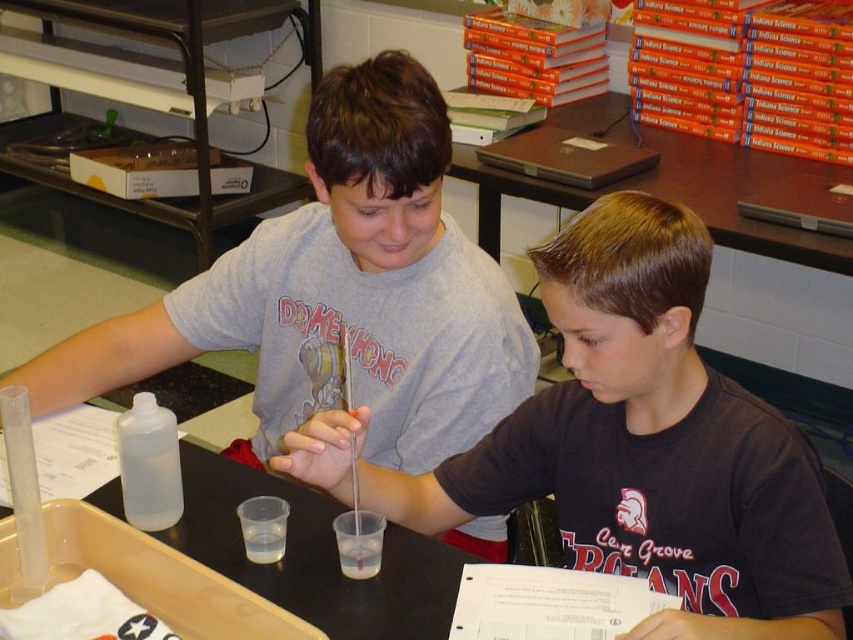
Between brown wooden table at upper center and transparent plastic bottle at center-left, which one has more height?

With more height is brown wooden table at upper center.

Which of these two, brown wooden table at upper center or transparent plastic bottle at center-left, stands shorter?

transparent plastic bottle at center-left is shorter.

Is point (619, 93) behind point (132, 440)?

Yes, point (619, 93) is farther from viewer.

I want to click on brown wooden table at upper center, so click(x=669, y=186).

Which is below, gray matte shirt at upper center or transparent plastic bottle at center-left?

transparent plastic bottle at center-left

Consider the image. Is gray matte shirt at upper center taller than transparent plastic bottle at center-left?

Yes.

Between point (425, 404) and point (125, 438), which one is positioned in front?

Point (125, 438) is in front.

Where is `gray matte shirt at upper center`? The width and height of the screenshot is (853, 640). gray matte shirt at upper center is located at coordinates (339, 292).

Between point (695, 288) and point (154, 525), which one is positioned in front?

Positioned in front is point (695, 288).

What do you see at coordinates (648, 445) in the screenshot? I see `black matte shirt at center` at bounding box center [648, 445].

This screenshot has height=640, width=853. Find the location of `black matte shirt at center`. black matte shirt at center is located at coordinates (648, 445).